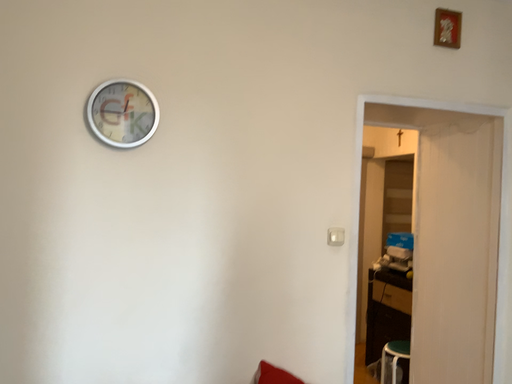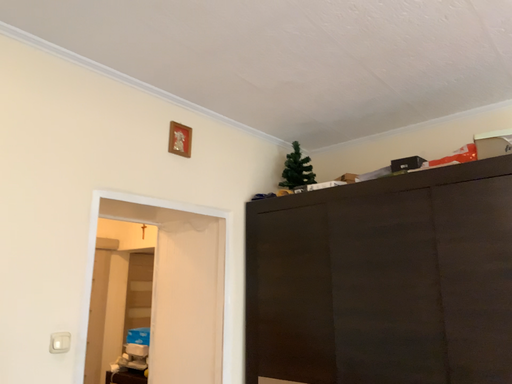
Question: How did the camera likely rotate when shooting the video?

Choices:
 (A) rotated left
 (B) rotated right

Answer: (B)